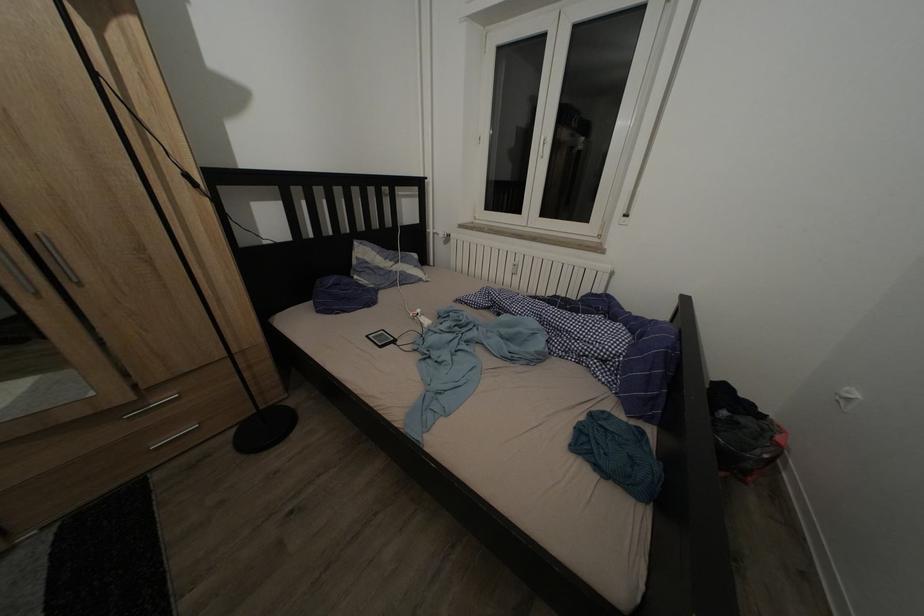
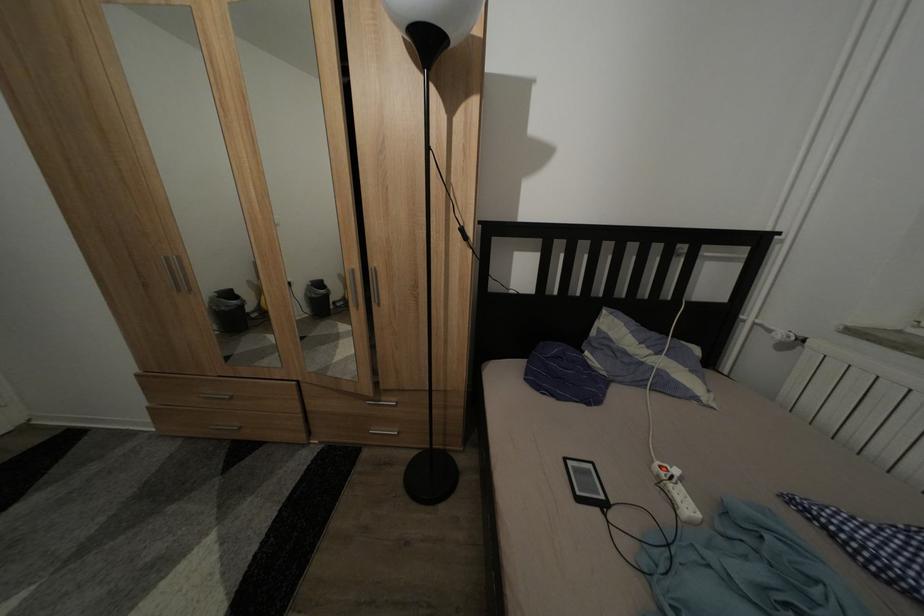
Question: How did the camera likely rotate?

Choices:
 (A) Left
 (B) Right
 (C) Up
 (D) Down

Answer: (A)